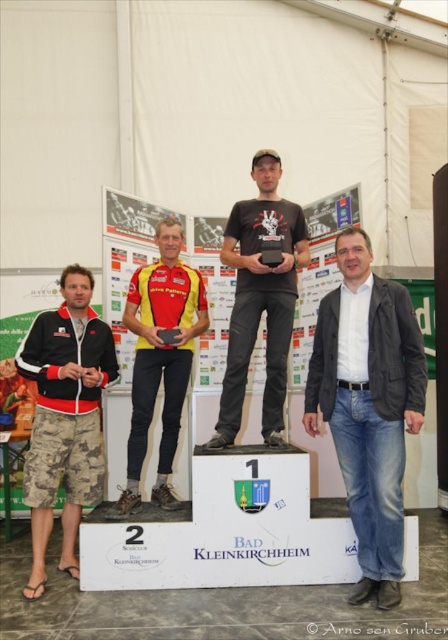
You are organizing a photo shoot and need to position a camera on a tripod. The camera requires a minimum of 1 meter of space between it and the objects in the scene. Given the dark gray blazer at center and the camouflage shorts at lower left, which object should you place the tripod closer to without violating the space requirement?

The dark gray blazer at center might be wider than camouflage shorts at lower left, so placing the tripod closer to the camouflage shorts at lower left would ensure the required 1 meter distance since it is narrower.

You are a photographer at this event and need to adjust your camera angle to ensure both the dark gray blazer at center and the yellow jersey at center are fully visible in the photo. Considering their heights, which clothing item should you focus on to frame the shot appropriately?

Result: The dark gray blazer at center is much taller than the yellow jersey at center, so focusing on the dark gray blazer at center will ensure both are visible as it is taller and can serve as the main focal point.